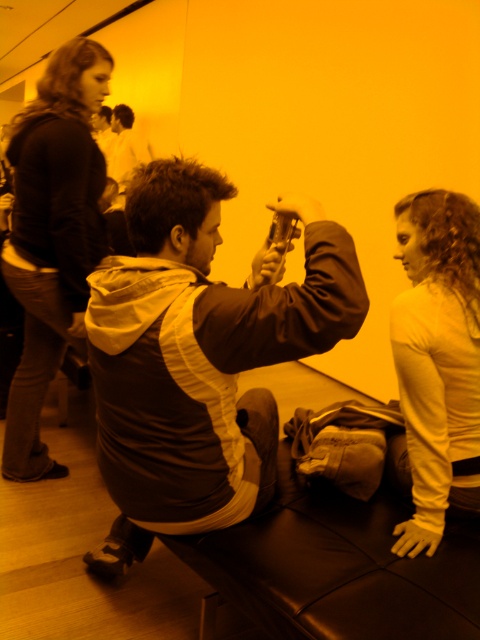
Question: Based on their relative distances, which object is nearer to the dark brown leather jacket at upper left?

Choices:
 (A) matte brown jacket at center
 (B) white long-sleeved shirt at right

Answer: (A)

Question: Is matte brown jacket at center below white long-sleeved shirt at right?

Choices:
 (A) yes
 (B) no

Answer: (B)

Question: In this image, where is dark brown leather jacket at upper left located relative to white long-sleeved shirt at right?

Choices:
 (A) left
 (B) right

Answer: (A)

Question: Can you confirm if matte brown jacket at center is thinner than white long-sleeved shirt at right?

Choices:
 (A) yes
 (B) no

Answer: (B)

Question: Which object is the closest to the matte brown jacket at center?

Choices:
 (A) white long-sleeved shirt at right
 (B) dark brown leather jacket at upper left

Answer: (A)

Question: Among these objects, which one is farthest from the camera?

Choices:
 (A) matte brown jacket at center
 (B) dark brown leather jacket at upper left
 (C) white long-sleeved shirt at right

Answer: (B)